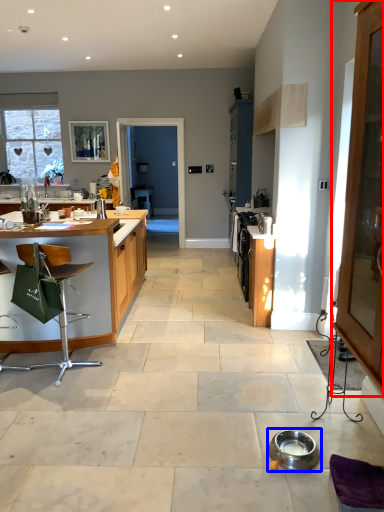
Question: Which of the following is the farthest to the observer, cabinetry (highlighted by a red box) or appliance (highlighted by a blue box)?

Choices:
 (A) cabinetry
 (B) appliance

Answer: (B)